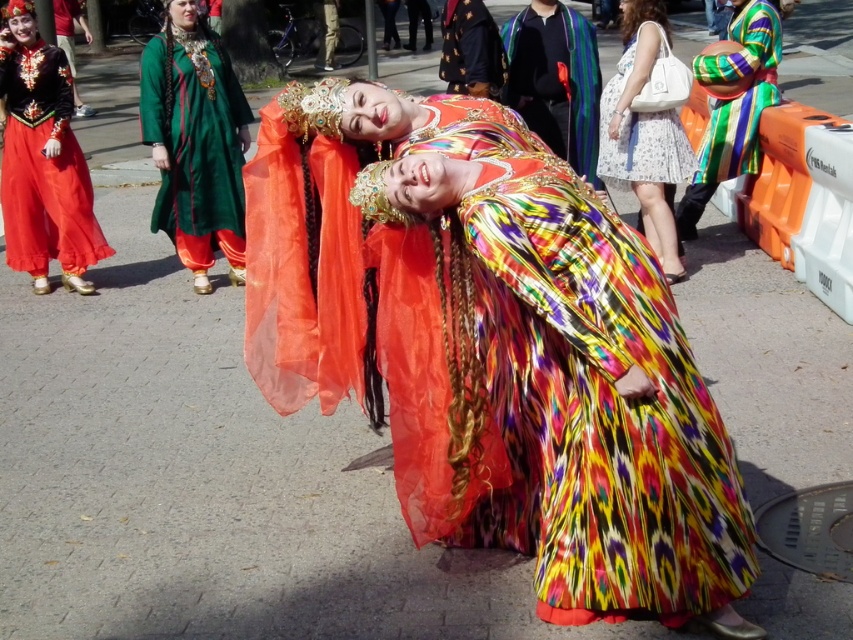
Question: Estimate the real-world distances between objects in this image. Which object is closer to the silky multicolored fabric at center?

Choices:
 (A) matte black dress at left
 (B) white floral dress at upper center

Answer: (B)

Question: Which of these objects is positioned farthest from the green silk dress at upper left?

Choices:
 (A) multicolored silk dress at center
 (B) matte black dress at left
 (C) white floral dress at upper center
 (D) gray metallic manhole cover at lower right

Answer: (D)

Question: In this image, where is green silk dress at upper left located relative to white floral dress at upper center?

Choices:
 (A) above
 (B) below

Answer: (B)

Question: Which object is positioned farthest from the multicolored silk dress at center?

Choices:
 (A) gray metallic manhole cover at lower right
 (B) white floral dress at upper center
 (C) green silk dress at upper left
 (D) silky multicolored fabric at center

Answer: (C)

Question: Can you confirm if multicolored silk dress at center is positioned to the left of silky multicolored fabric at center?

Choices:
 (A) yes
 (B) no

Answer: (A)

Question: In this image, where is multicolored silk dress at center located relative to matte black dress at left?

Choices:
 (A) left
 (B) right

Answer: (B)